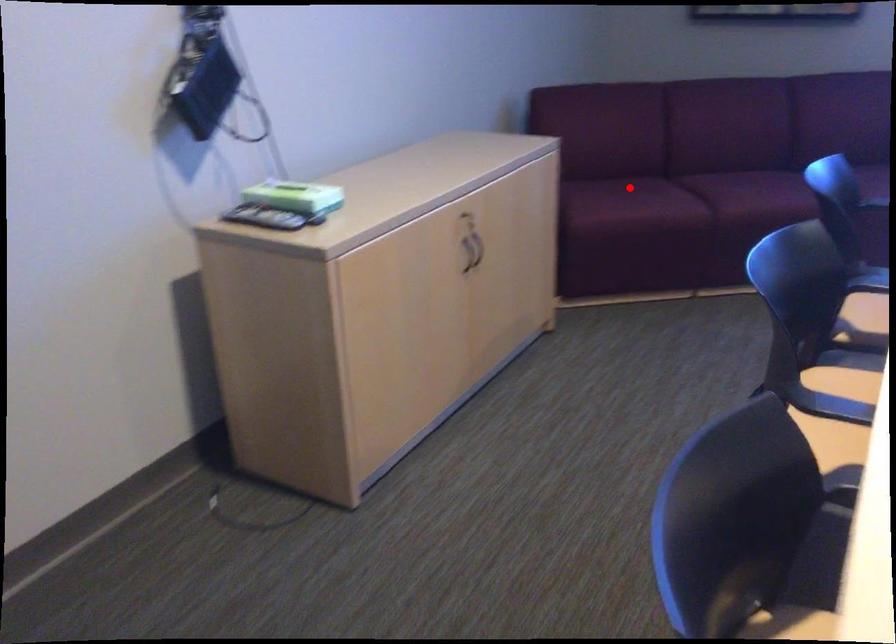
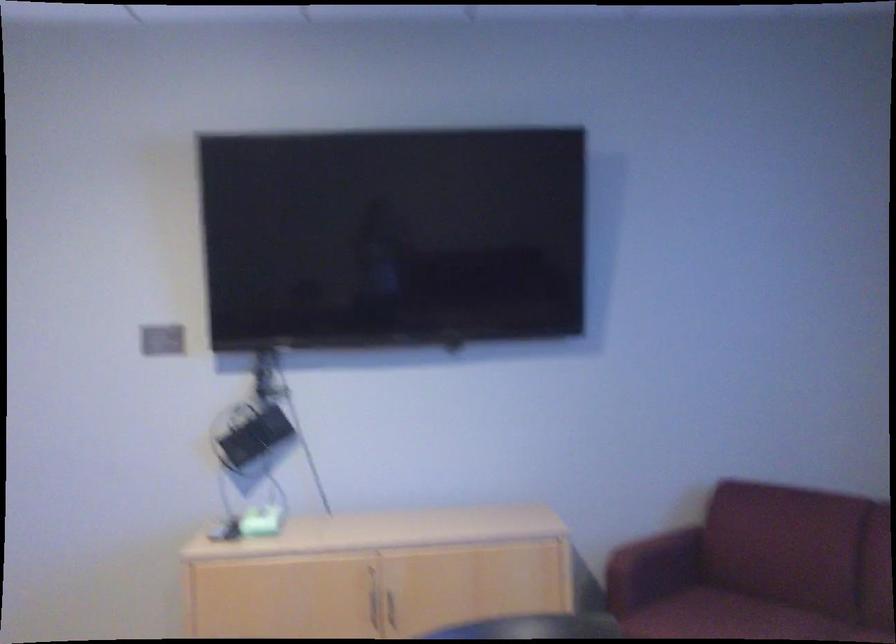
Question: A red point is marked in image1. In image2, is the corresponding 3D point closer to the camera or farther? Reply with the corresponding letter.

Choices:
 (A) The corresponding 3D point is closer.
 (B) The corresponding 3D point is farther.

Answer: (A)